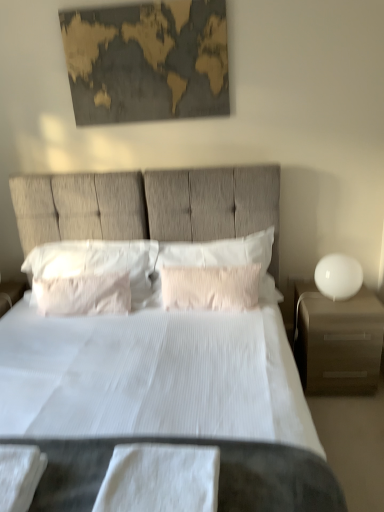
Question: Is white glossy sphere at right in contact with matte brown nightstand at right?

Choices:
 (A) no
 (B) yes

Answer: (A)

Question: From a real-world perspective, is white glossy sphere at right on top of matte brown nightstand at right?

Choices:
 (A) yes
 (B) no

Answer: (A)

Question: From the image's perspective, is white glossy sphere at right on matte brown nightstand at right?

Choices:
 (A) no
 (B) yes

Answer: (B)

Question: Would you say white glossy sphere at right contains matte brown nightstand at right?

Choices:
 (A) yes
 (B) no

Answer: (B)

Question: Is white glossy sphere at right oriented towards matte brown nightstand at right?

Choices:
 (A) yes
 (B) no

Answer: (B)

Question: Based on their sizes in the image, would you say white textured bed at center is bigger or smaller than white soft pillow at center, marked as the 4th pillow in a right-to-left arrangement?

Choices:
 (A) big
 (B) small

Answer: (A)

Question: Is white textured bed at center wider or thinner than white soft pillow at center, marked as the 4th pillow in a right-to-left arrangement?

Choices:
 (A) wide
 (B) thin

Answer: (A)

Question: Would you say white textured bed at center is to the left or to the right of white soft pillow at center, placed as the first pillow when sorted from left to right, in the picture?

Choices:
 (A) left
 (B) right

Answer: (B)

Question: From a real-world perspective, is white textured bed at center positioned above or below white soft pillow at center, marked as the 4th pillow in a right-to-left arrangement?

Choices:
 (A) below
 (B) above

Answer: (A)

Question: Is white cotton sheet at center, the first sheet viewed from the right, situated inside gold textured map at upper center or outside?

Choices:
 (A) inside
 (B) outside

Answer: (B)

Question: Looking at the image, does white cotton sheet at center, the first sheet viewed from the right, seem bigger or smaller compared to gold textured map at upper center?

Choices:
 (A) small
 (B) big

Answer: (A)

Question: In terms of width, does white cotton sheet at center, the 2th sheet positioned from the left, look wider or thinner when compared to gold textured map at upper center?

Choices:
 (A) thin
 (B) wide

Answer: (B)

Question: Considering their positions, is white cotton sheet at center, the 2th sheet positioned from the left, located in front of or behind gold textured map at upper center?

Choices:
 (A) front
 (B) behind

Answer: (A)

Question: Is matte brown nightstand at right inside or outside of white cotton towel at lower left, which is the first sheet from left to right?

Choices:
 (A) inside
 (B) outside

Answer: (B)

Question: From the image's perspective, is matte brown nightstand at right above or below white cotton towel at lower left, the second sheet from the right?

Choices:
 (A) below
 (B) above

Answer: (B)